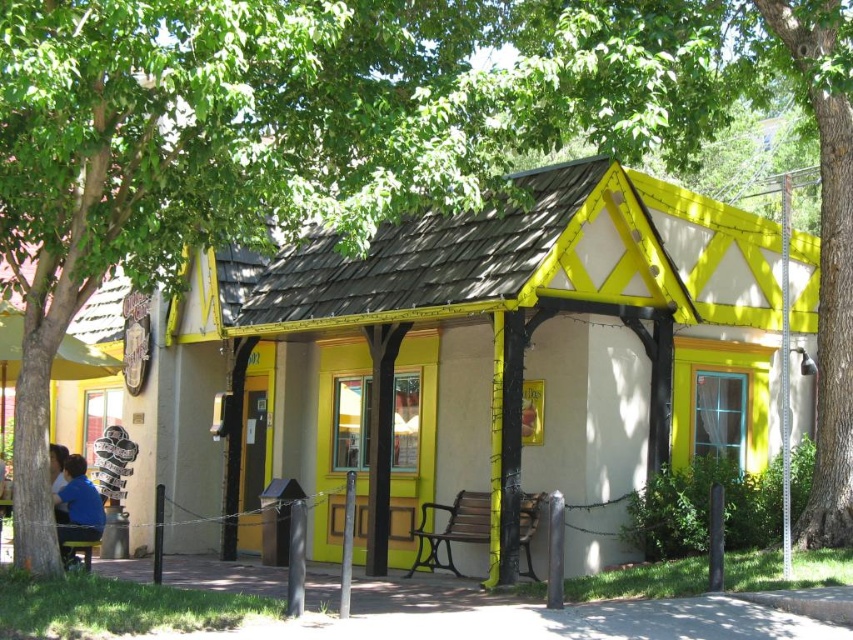
Can you confirm if yellow wood cabin at center is shorter than blue shirt at lower left?

Yes, yellow wood cabin at center is shorter than blue shirt at lower left.

Can you confirm if yellow wood cabin at center is bigger than blue shirt at lower left?

No.

Who is more forward, (527, 180) or (76, 477)?

Point (76, 477) is more forward.

Locate an element on the screen. Image resolution: width=853 pixels, height=640 pixels. yellow wood cabin at center is located at coordinates (519, 340).